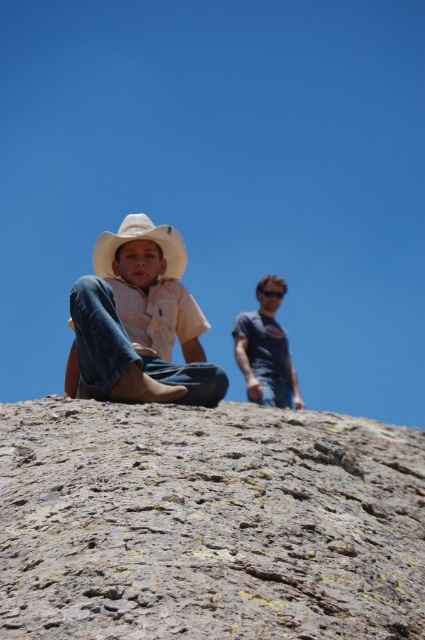
Does rusty stone rock at center have a lesser width compared to white matte cowboy hat at center?

Correct, rusty stone rock at center's width is less than white matte cowboy hat at center's.

Does point (289, 465) lie behind point (124, 234)?

That is False.

The image size is (425, 640). In order to click on rusty stone rock at center in this screenshot , I will do `click(207, 524)`.

Is the position of rusty stone rock at center more distant than that of matte white cowboy hat at center?

No, it is not.

Which is more to the left, rusty stone rock at center or matte white cowboy hat at center?

matte white cowboy hat at center

You are a GUI agent. You are given a task and a screenshot of the screen. Output one action in this format:
    pyautogui.click(x=<x>, y=<y>)
    Task: Click on the rusty stone rock at center
    
    Given the screenshot: What is the action you would take?
    (x=207, y=524)

In the scene shown: How far apart are matte white cowboy hat at center and white matte cowboy hat at center?

The distance of matte white cowboy hat at center from white matte cowboy hat at center is 6.09 meters.

Is point (153, 268) in front of point (158, 227)?

Yes, point (153, 268) is in front of point (158, 227).

Where is `matte white cowboy hat at center`? This screenshot has height=640, width=425. matte white cowboy hat at center is located at coordinates (141, 321).